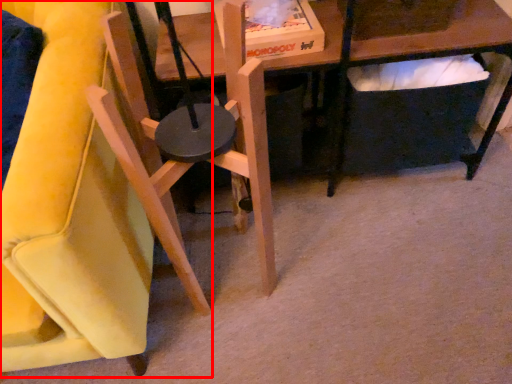
Question: From the image's perspective, where is chair (annotated by the red box) located relative to chair?

Choices:
 (A) below
 (B) above

Answer: (B)